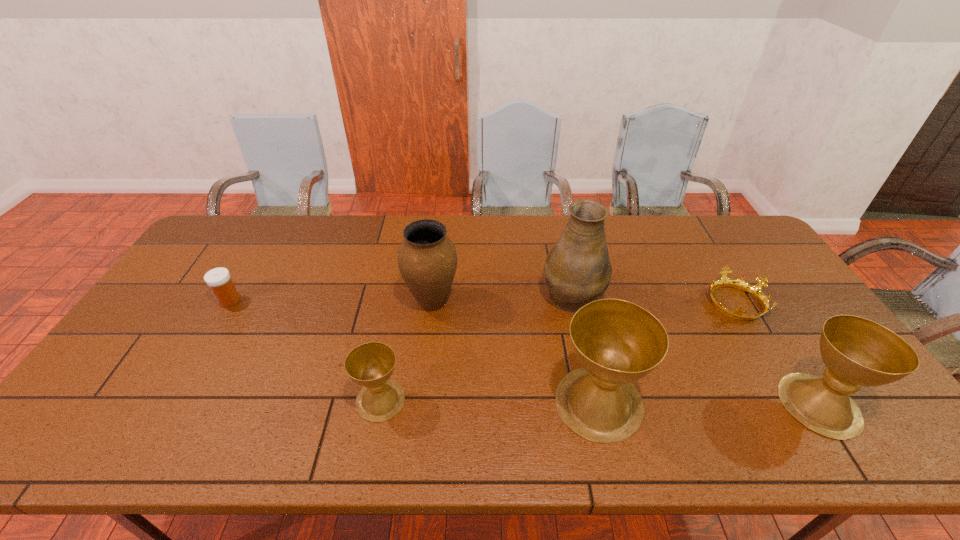
This screenshot has height=540, width=960. I want to click on the shortest chalice, so (370, 365).

The width and height of the screenshot is (960, 540). Find the location of `the third shortest object`. the third shortest object is located at coordinates (370, 365).

The image size is (960, 540). I want to click on the second chalice from left to right, so click(617, 342).

You are a GUI agent. You are given a task and a screenshot of the screen. Output one action in this format:
    pyautogui.click(x=<x>, y=<y>)
    Task: Click on the fourth shortest object
    
    Given the screenshot: What is the action you would take?
    tap(857, 352)

Where is `the second shortest chalice`? The height and width of the screenshot is (540, 960). the second shortest chalice is located at coordinates click(x=857, y=352).

Find the location of a particular element. the shortest object is located at coordinates (754, 290).

You are a GUI agent. You are given a task and a screenshot of the screen. Output one action in this format:
    pyautogui.click(x=<x>, y=<y>)
    Task: Click on the tallest object
    The width and height of the screenshot is (960, 540).
    Given the screenshot: What is the action you would take?
    pyautogui.click(x=577, y=270)

The height and width of the screenshot is (540, 960). I want to click on urn, so click(x=427, y=259).

This screenshot has width=960, height=540. I want to click on the second shortest object, so click(x=218, y=279).

Locate an element on the screen. The height and width of the screenshot is (540, 960). the leftmost object is located at coordinates (218, 279).